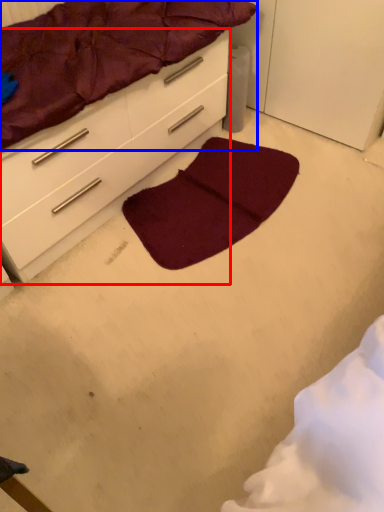
Question: Which object is further to the camera taking this photo, chest of drawers (highlighted by a red box) or mattress (highlighted by a blue box)?

Choices:
 (A) chest of drawers
 (B) mattress

Answer: (A)